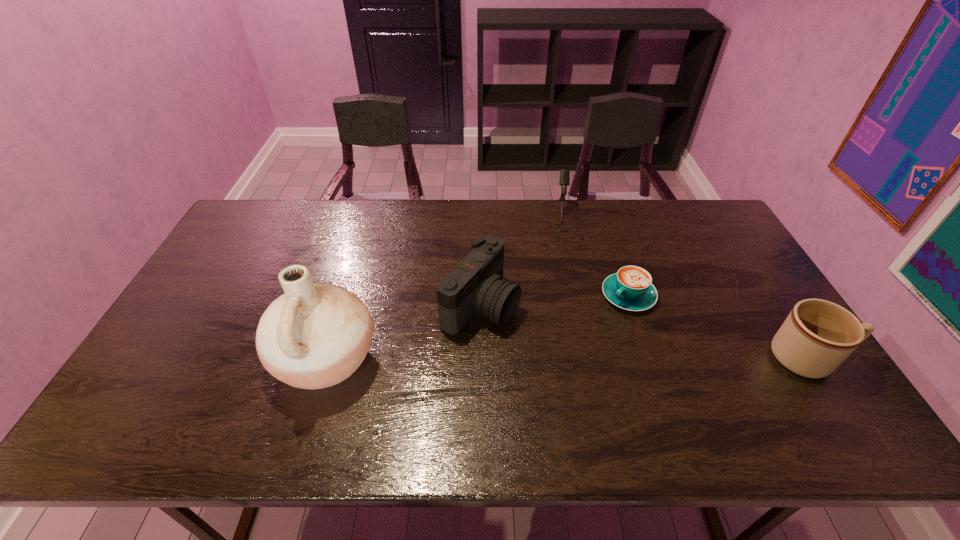
Where is `vacant point located between the rightmost object and the fourth object from right to left`? vacant point located between the rightmost object and the fourth object from right to left is located at coordinates (644, 331).

Locate an element on the screen. vacant region between the second tallest object and the farthest object is located at coordinates (520, 263).

Locate an element on the screen. Image resolution: width=960 pixels, height=540 pixels. vacant area that lies between the shortest object and the second tallest object is located at coordinates (555, 300).

Where is `vacant area between the microphone and the shortest object`? This screenshot has width=960, height=540. vacant area between the microphone and the shortest object is located at coordinates (594, 259).

I want to click on vacant area that lies between the mug and the shortest object, so click(x=718, y=327).

I want to click on free point between the mug and the shortest object, so click(x=718, y=327).

Locate an element on the screen. The image size is (960, 540). vacant area that lies between the microphone and the rightmost object is located at coordinates (684, 289).

Image resolution: width=960 pixels, height=540 pixels. I want to click on vacant region between the cappuccino and the mug, so click(718, 327).

Find the location of a particular element. The height and width of the screenshot is (540, 960). vacant space in between the fourth shortest object and the rightmost object is located at coordinates (644, 331).

Locate which object is the closest to the pottery. Please provide its 2D coordinates. Your answer should be formatted as a tuple, i.e. [(x, y)], where the tuple contains the x and y coordinates of a point satisfying the conditions above.

[(476, 286)]